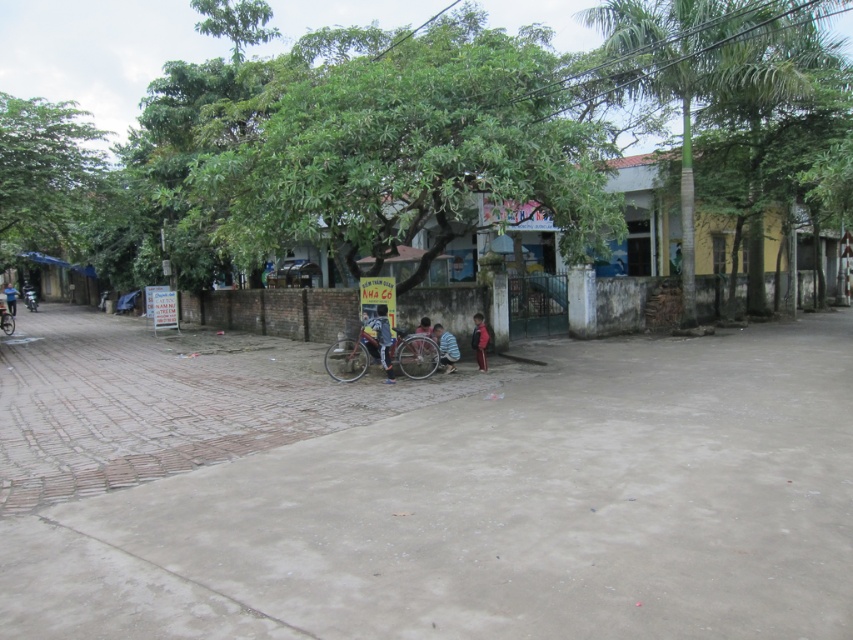
Question: Among these points, which one is farthest from the camera?

Choices:
 (A) [27, 138]
 (B) [358, 356]
 (C) [747, 45]

Answer: (A)

Question: Which point appears farthest from the camera in this image?

Choices:
 (A) (4, 332)
 (B) (16, 506)
 (C) (387, 323)
 (D) (4, 285)

Answer: (D)

Question: Estimate the real-world distances between objects in this image. Which object is farther from the dark blue jeans at lower center?

Choices:
 (A) metallic silver bicycle at center
 (B) metallic silver motorcycle at left

Answer: (B)

Question: Does concrete pavement at center lie in front of metallic silver bicycle at center?

Choices:
 (A) no
 (B) yes

Answer: (B)

Question: Can you confirm if denim jacket at center is bigger than striped shirt at center?

Choices:
 (A) no
 (B) yes

Answer: (B)

Question: Considering the relative positions of striped shirt at center and striped fabric shirt at center in the image provided, where is striped shirt at center located with respect to striped fabric shirt at center?

Choices:
 (A) right
 (B) left

Answer: (A)